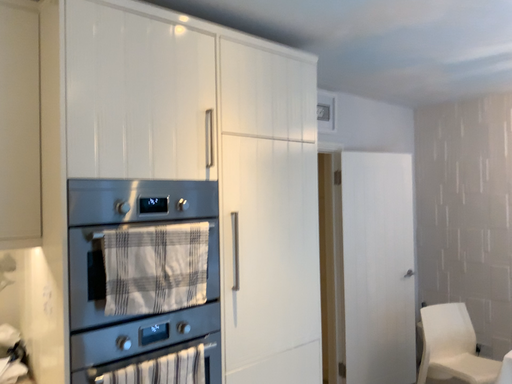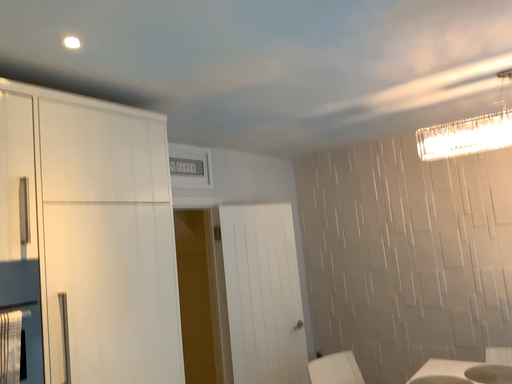
Question: Which way did the camera rotate in the video?

Choices:
 (A) rotated upward
 (B) rotated downward

Answer: (A)